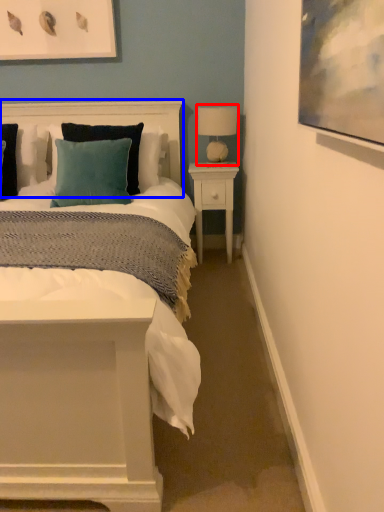
Question: Among these objects, which one is farthest to the camera, table lamp (highlighted by a red box) or headboard (highlighted by a blue box)?

Choices:
 (A) table lamp
 (B) headboard

Answer: (A)